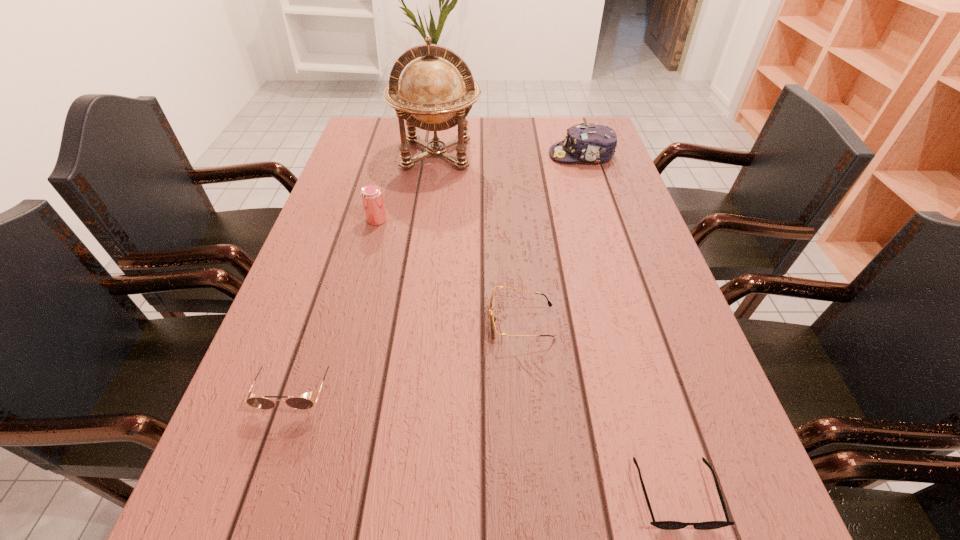
The height and width of the screenshot is (540, 960). Identify the location of globe present at the left edge. (431, 95).

This screenshot has height=540, width=960. Identify the location of beer can that is at the left edge. (372, 197).

You are a GUI agent. You are given a task and a screenshot of the screen. Output one action in this format:
    pyautogui.click(x=<x>, y=<y>)
    Task: Click on the sunglasses at the left edge
    The height and width of the screenshot is (540, 960).
    Given the screenshot: What is the action you would take?
    pyautogui.click(x=300, y=403)

Where is `headwear that is at the right edge`? headwear that is at the right edge is located at coordinates (596, 143).

This screenshot has width=960, height=540. What are the coordinates of `sunglasses situated at the right edge` in the screenshot? It's located at (666, 525).

Locate an element on the screen. The height and width of the screenshot is (540, 960). object that is at the far left corner is located at coordinates [431, 95].

Image resolution: width=960 pixels, height=540 pixels. What are the coordinates of `object at the far right corner` in the screenshot? It's located at (596, 143).

The image size is (960, 540). Identify the location of blank space at the far edge. (526, 122).

The width and height of the screenshot is (960, 540). What are the coordinates of `free region at the left edge of the desktop` in the screenshot? It's located at (345, 221).

In the image, there is a desktop. At what (x,y) coordinates should I click in order to perform the action: click on free space at the right edge. Please return your answer as a coordinate pair (x, y). Looking at the image, I should click on (746, 465).